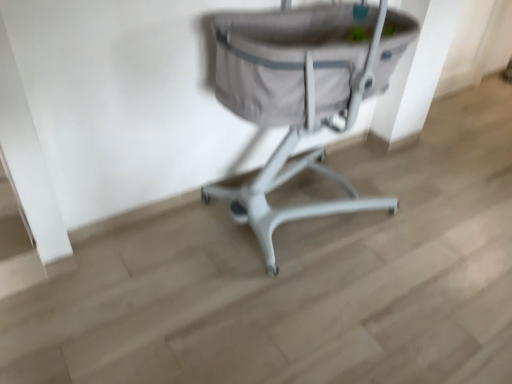
This screenshot has width=512, height=384. Find the location of `free location in front of white plastic baby swing at center`. free location in front of white plastic baby swing at center is located at coordinates (329, 312).